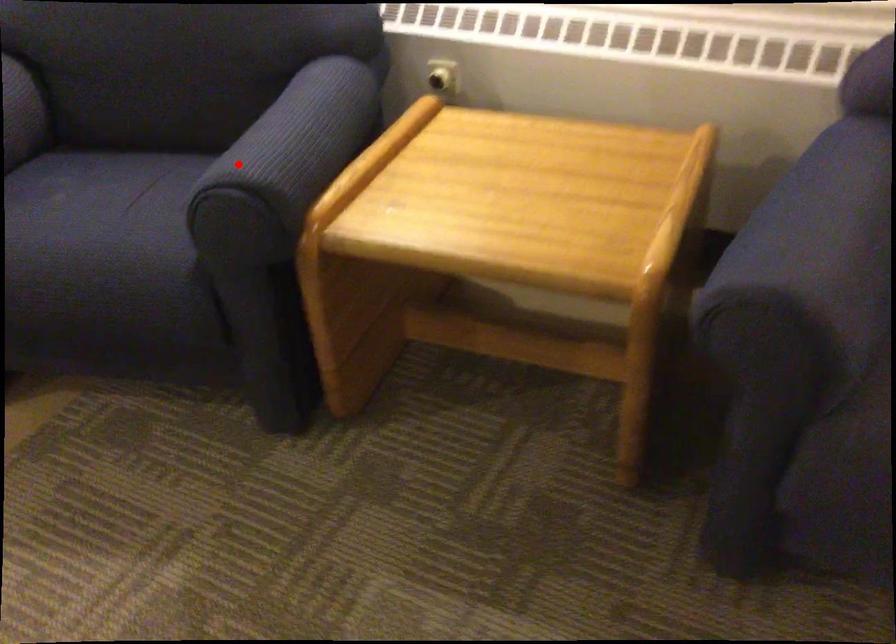
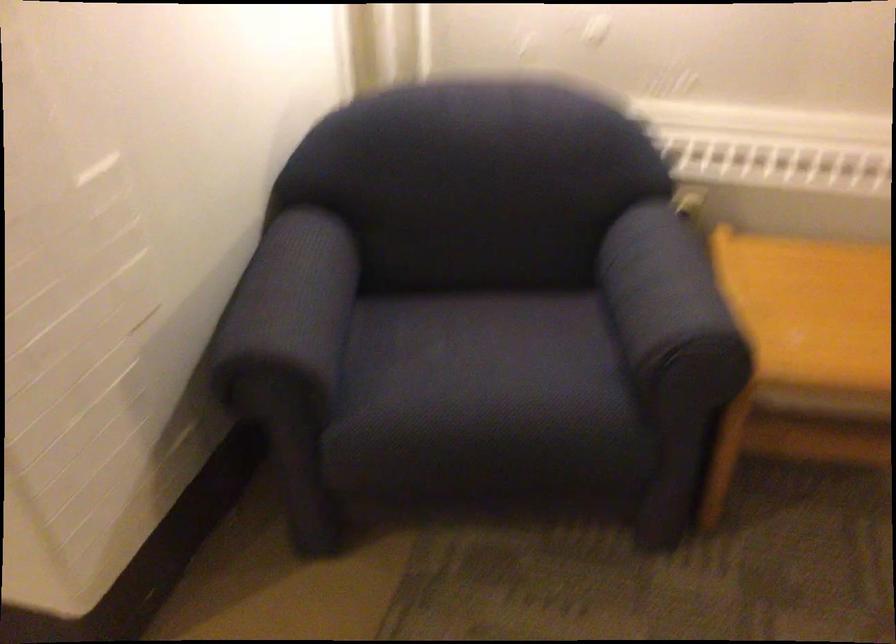
Question: I am providing you with two images of the same scene from different viewpoints. Given a red point in image1, look at the same physical point in image2. Is it:

Choices:
 (A) Closer to the viewpoint
 (B) Farther from the viewpoint

Answer: (B)